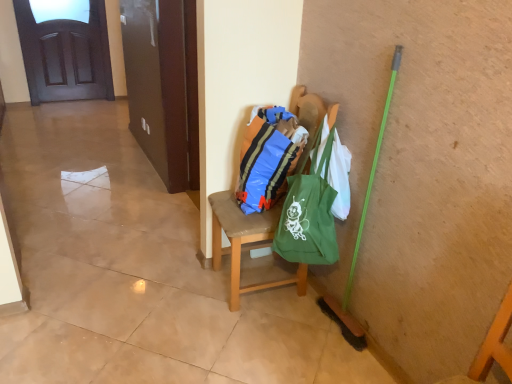
Question: From the image's perspective, is green fabric bag at center over blue plastic bag at center?

Choices:
 (A) yes
 (B) no

Answer: (B)

Question: Is green fabric bag at center wider than blue plastic bag at center?

Choices:
 (A) yes
 (B) no

Answer: (B)

Question: Does green fabric bag at center appear on the right side of blue plastic bag at center?

Choices:
 (A) no
 (B) yes

Answer: (B)

Question: Is green fabric bag at center outside of blue plastic bag at center?

Choices:
 (A) no
 (B) yes

Answer: (B)

Question: From a real-world perspective, is green fabric bag at center over blue plastic bag at center?

Choices:
 (A) no
 (B) yes

Answer: (B)

Question: Considering their positions, is green canvas tote at center located in front of or behind blue plastic bag at center?

Choices:
 (A) behind
 (B) front

Answer: (B)

Question: Is point (326, 203) closer or farther from the camera than point (293, 135)?

Choices:
 (A) closer
 (B) farther

Answer: (A)

Question: From a real-world perspective, relative to blue plastic bag at center, is green canvas tote at center vertically above or below?

Choices:
 (A) below
 (B) above

Answer: (A)

Question: Looking at their shapes, would you say green canvas tote at center is wider or thinner than blue plastic bag at center?

Choices:
 (A) thin
 (B) wide

Answer: (B)

Question: From a real-world perspective, relative to green fabric bag at center, is dark wood door at upper left vertically above or below?

Choices:
 (A) below
 (B) above

Answer: (A)

Question: Considering the positions of dark wood door at upper left and green fabric bag at center in the image, is dark wood door at upper left taller or shorter than green fabric bag at center?

Choices:
 (A) tall
 (B) short

Answer: (A)

Question: Looking at the image, does dark wood door at upper left seem bigger or smaller compared to green fabric bag at center?

Choices:
 (A) small
 (B) big

Answer: (B)

Question: Relative to green fabric bag at center, is dark wood door at upper left in front or behind?

Choices:
 (A) front
 (B) behind

Answer: (B)

Question: Considering the positions of blue plastic bag at center and green fabric bag at center in the image, is blue plastic bag at center taller or shorter than green fabric bag at center?

Choices:
 (A) short
 (B) tall

Answer: (A)

Question: In the image, is blue plastic bag at center positioned in front of or behind green fabric bag at center?

Choices:
 (A) front
 (B) behind

Answer: (B)